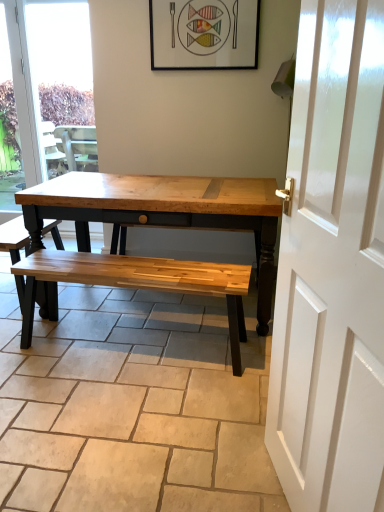
Question: Is wooden bench at center directly adjacent to natural wood bench at center?

Choices:
 (A) no
 (B) yes

Answer: (A)

Question: Is wooden bench at center closer to the viewer compared to natural wood bench at center?

Choices:
 (A) no
 (B) yes

Answer: (A)

Question: From the image's perspective, is wooden bench at center on natural wood bench at center?

Choices:
 (A) no
 (B) yes

Answer: (B)

Question: Does wooden bench at center appear on the left side of natural wood bench at center?

Choices:
 (A) yes
 (B) no

Answer: (A)

Question: Can you confirm if wooden bench at center is positioned to the right of natural wood bench at center?

Choices:
 (A) no
 (B) yes

Answer: (A)

Question: From a real-world perspective, is wooden bench at center on top of natural wood bench at center?

Choices:
 (A) yes
 (B) no

Answer: (A)

Question: Is transparent glass window at upper left not inside wooden bench at center?

Choices:
 (A) no
 (B) yes

Answer: (B)

Question: From a real-world perspective, is transparent glass window at upper left located higher than wooden bench at center?

Choices:
 (A) yes
 (B) no

Answer: (A)

Question: Are transparent glass window at upper left and wooden bench at center located far from each other?

Choices:
 (A) no
 (B) yes

Answer: (B)

Question: From the image's perspective, is transparent glass window at upper left under wooden bench at center?

Choices:
 (A) yes
 (B) no

Answer: (B)

Question: Can you confirm if transparent glass window at upper left is bigger than wooden bench at center?

Choices:
 (A) no
 (B) yes

Answer: (B)

Question: Is transparent glass window at upper left behind wooden bench at center?

Choices:
 (A) no
 (B) yes

Answer: (B)

Question: From the image's perspective, is natural wood bench at center on wooden bench at center?

Choices:
 (A) yes
 (B) no

Answer: (B)